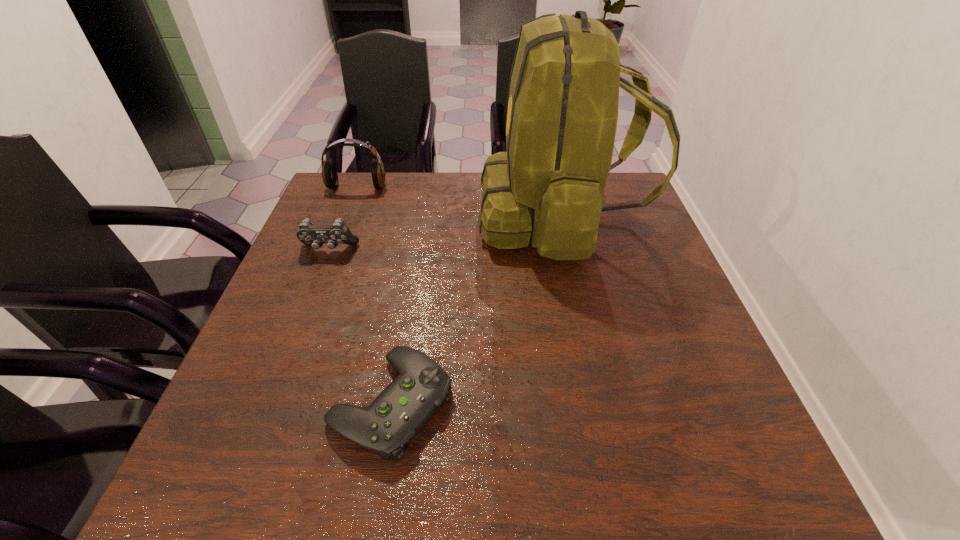
You are a GUI agent. You are given a task and a screenshot of the screen. Output one action in this format:
    pyautogui.click(x=<x>, y=<y>)
    Task: Click on the tallest object
    This screenshot has height=540, width=960.
    Given the screenshot: What is the action you would take?
    pyautogui.click(x=562, y=111)

Where is `backpack`? The height and width of the screenshot is (540, 960). backpack is located at coordinates (562, 111).

At what (x,y) coordinates should I click in order to perform the action: click on the third shortest object. Please return your answer as a coordinate pair (x, y). The width and height of the screenshot is (960, 540). Looking at the image, I should click on (329, 173).

Identify the location of the farther control. This screenshot has width=960, height=540. (309, 234).

Where is `the second shortest object`? This screenshot has width=960, height=540. the second shortest object is located at coordinates (309, 234).

Find the location of `the nearer control`. the nearer control is located at coordinates (399, 413).

The height and width of the screenshot is (540, 960). I want to click on the shortest object, so click(399, 413).

The image size is (960, 540). I want to click on vacant point located on the front-facing side of the rightmost object, so click(401, 217).

Locate an element on the screen. vacant space situated on the front-facing side of the rightmost object is located at coordinates (408, 217).

This screenshot has width=960, height=540. Find the location of `free space located on the front-facing side of the rightmost object`. free space located on the front-facing side of the rightmost object is located at coordinates (462, 217).